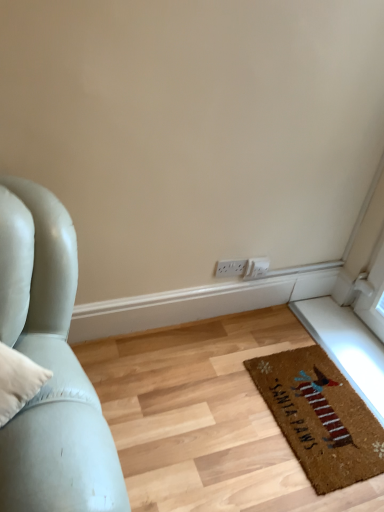
The height and width of the screenshot is (512, 384). I want to click on free space to the left of brown coir mat at lower right, so click(x=221, y=401).